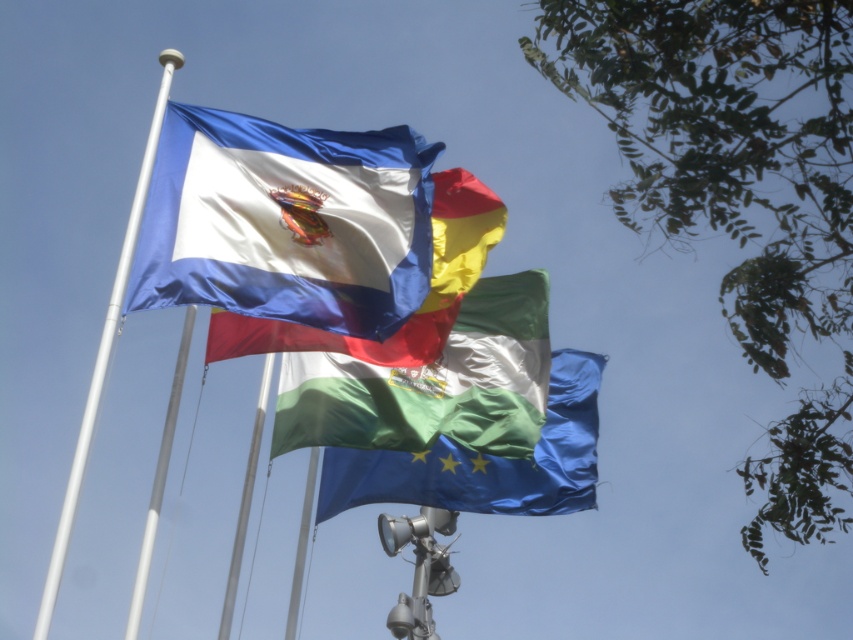
Can you confirm if blue glossy flag at center is bigger than silky white flag at center?

Indeed, blue glossy flag at center has a larger size compared to silky white flag at center.

Who is more forward, (x=570, y=436) or (x=476, y=240)?

Point (x=476, y=240) is in front.

Image resolution: width=853 pixels, height=640 pixels. Find the location of `blue glossy flag at center`. blue glossy flag at center is located at coordinates (485, 460).

Between point (271, 260) and point (180, 387), which one is positioned behind?

Positioned behind is point (180, 387).

Who is shorter, satin blue flag at upper center or white metallic flag pole at left?

satin blue flag at upper center

At what (x,y) coordinates should I click in order to perform the action: click on satin blue flag at upper center. Please return your answer as a coordinate pair (x, y). Looking at the image, I should click on coord(286,221).

Between point (323, 483) and point (225, 596), which one is positioned in front?

Point (225, 596)

Where is `blue glossy flag at center`? The height and width of the screenshot is (640, 853). blue glossy flag at center is located at coordinates (485, 460).